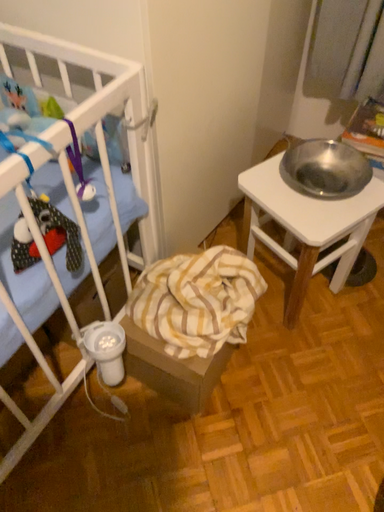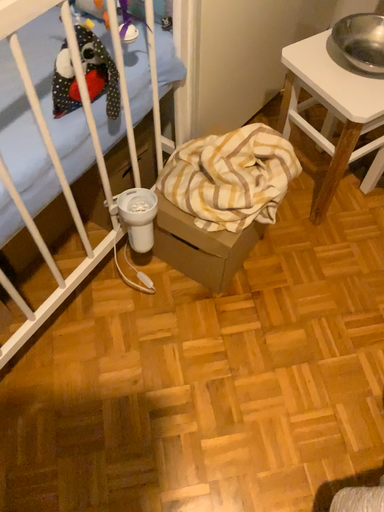
Question: Which way did the camera rotate in the video?

Choices:
 (A) rotated downward
 (B) rotated upward

Answer: (A)